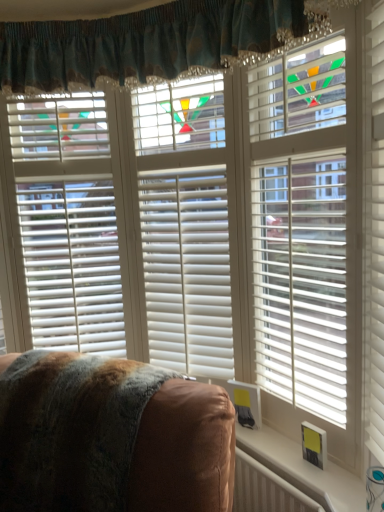
Question: Would you say white plastic radiator at lower right is to the left or to the right of white matte blinds at right, which is counted as the 1th blind, starting from the right, in the picture?

Choices:
 (A) right
 (B) left

Answer: (B)

Question: Looking at their shapes, would you say white plastic radiator at lower right is wider or thinner than white matte blinds at right, which is counted as the 1th blind, starting from the right?

Choices:
 (A) thin
 (B) wide

Answer: (A)

Question: Which is nearer to the teal fabric curtain at upper center?

Choices:
 (A) brown leather chair at lower left
 (B) white matte blinds at right, which is counted as the 1th blind, starting from the right
 (C) white plastic radiator at lower right
 (D) white plastic radiator at lower right
 (E) white matte blinds at center, positioned as the 2th blind in left-to-right order

Answer: (E)

Question: Which object is positioned closest to the white matte blinds at center, positioned as the 2th blind in left-to-right order?

Choices:
 (A) white wood blinds at left, placed as the 3th blind when sorted from right to left
 (B) teal fabric curtain at upper center
 (C) white matte blinds at right, which is counted as the 3th blind, starting from the left
 (D) brown leather chair at lower left
 (E) white plastic radiator at lower right

Answer: (C)